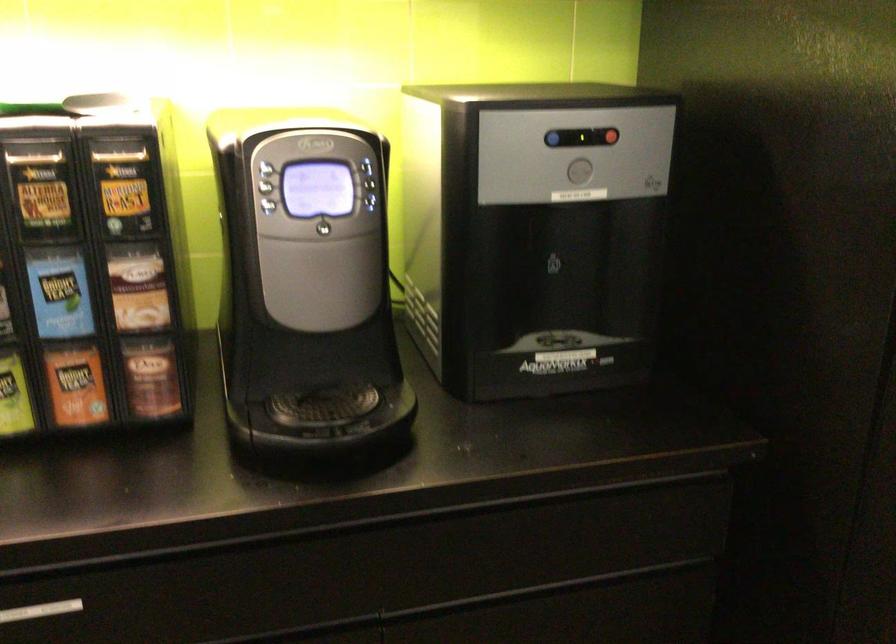
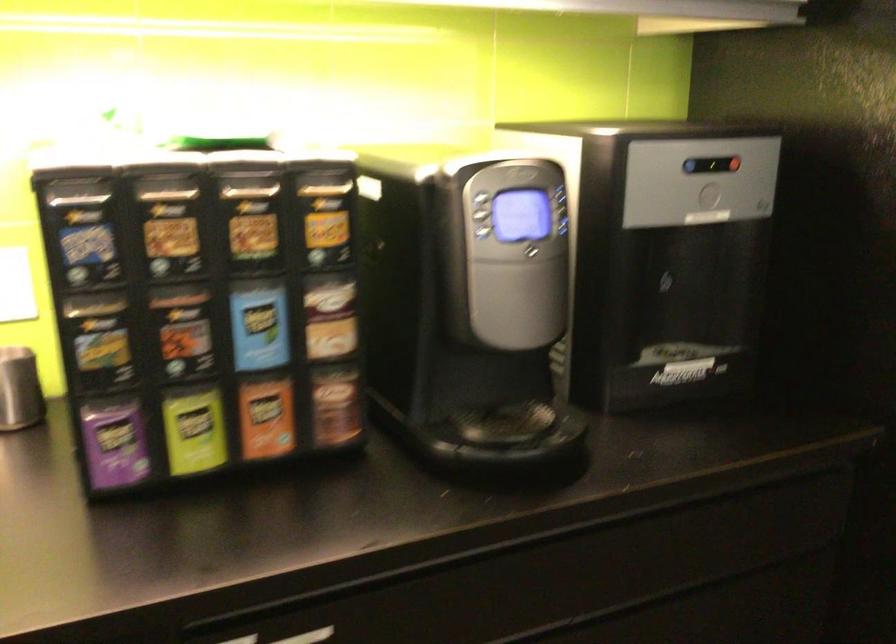
In the second image, find the point that corresponds to point (158, 375) in the first image.

(336, 406)